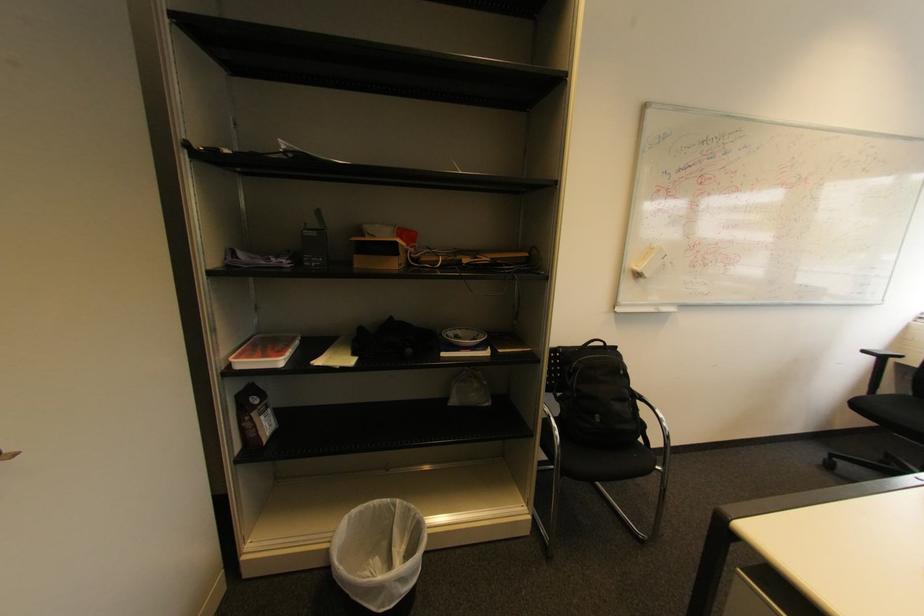
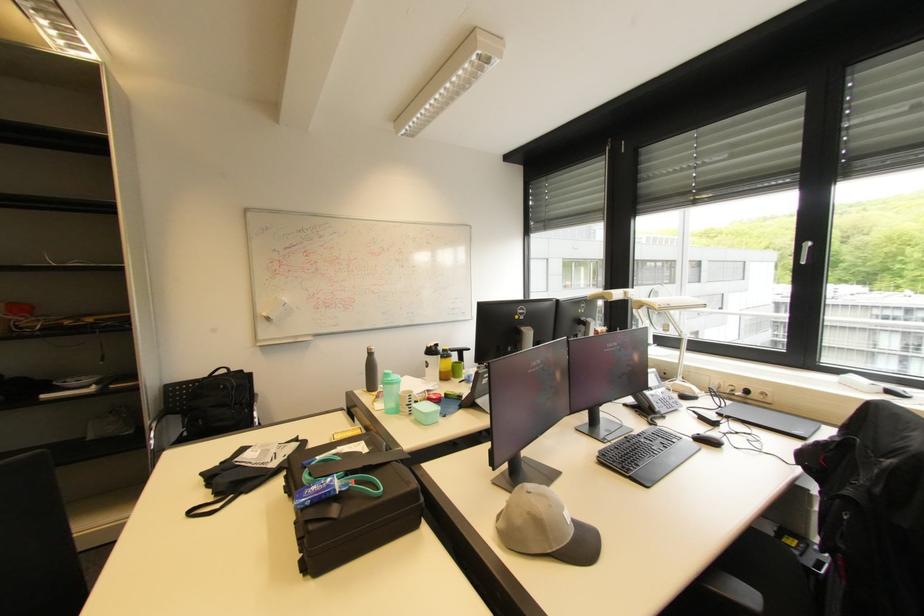
In the second image, find the point that corresponds to point (613, 345) in the first image.

(237, 371)